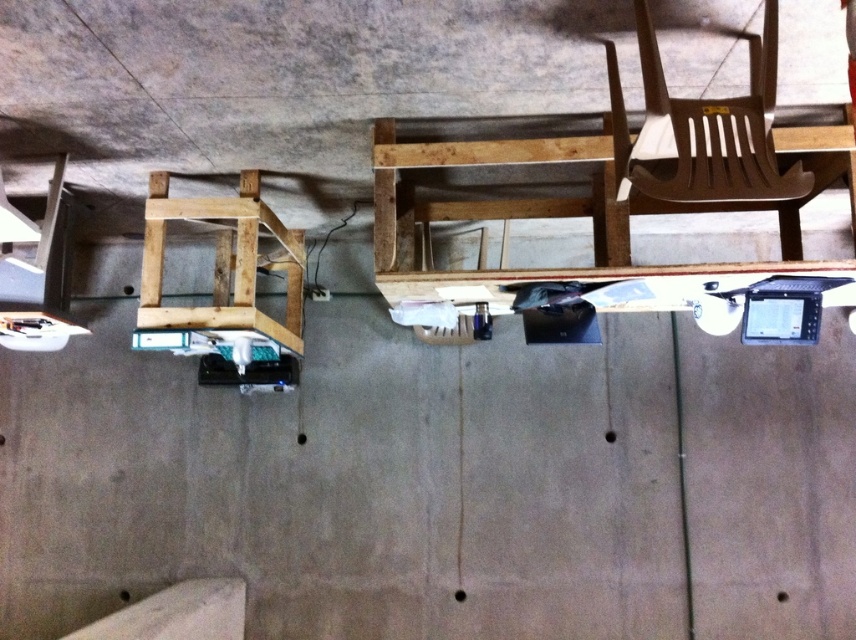
Question: Which of the following is the farthest from the observer?

Choices:
 (A) white matte ramp at lower left
 (B) mahogany wood chair at upper right
 (C) natural wood stool at left

Answer: (C)

Question: Which of these objects is positioned closest to the white matte ramp at lower left?

Choices:
 (A) natural wood stool at left
 (B) mahogany wood chair at upper right

Answer: (A)

Question: Can you confirm if mahogany wood chair at upper right is positioned to the left of white matte ramp at lower left?

Choices:
 (A) no
 (B) yes

Answer: (A)

Question: Can you confirm if mahogany wood chair at upper right is positioned to the right of natural wood stool at left?

Choices:
 (A) no
 (B) yes

Answer: (B)

Question: Is the position of natural wood stool at left less distant than that of white matte ramp at lower left?

Choices:
 (A) no
 (B) yes

Answer: (A)

Question: Based on their relative distances, which object is nearer to the natural wood stool at left?

Choices:
 (A) white matte ramp at lower left
 (B) mahogany wood chair at upper right

Answer: (A)